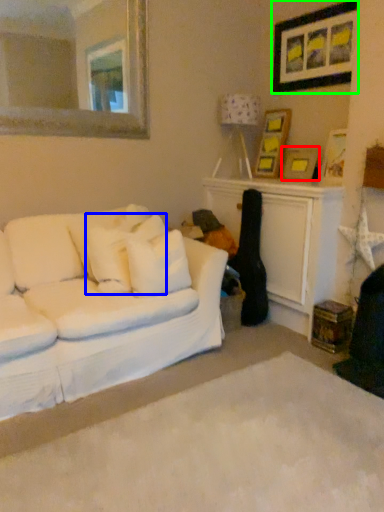
Question: Considering the real-world distances, which object is closest to picture frame (highlighted by a red box)? pillow (highlighted by a blue box) or picture frame (highlighted by a green box).

Choices:
 (A) pillow
 (B) picture frame

Answer: (B)